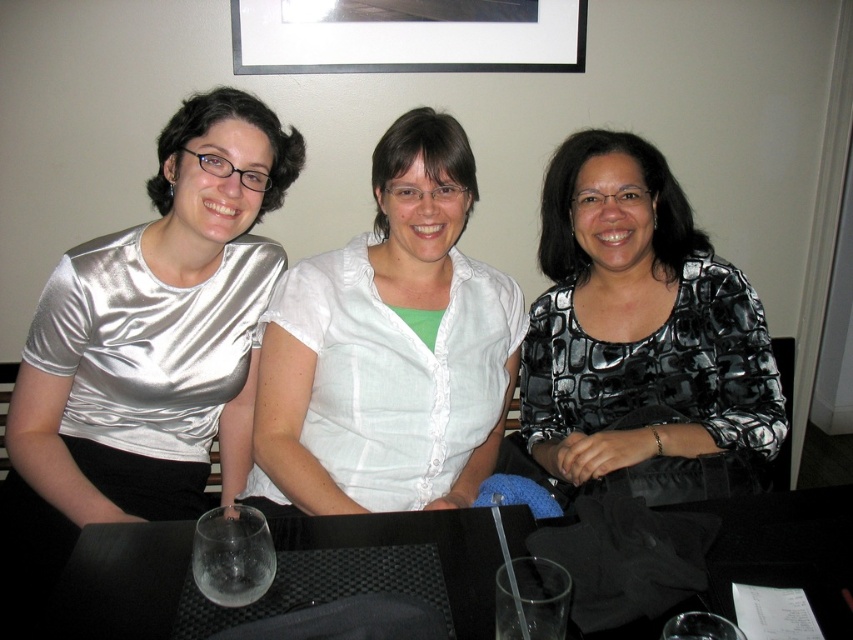
Is black matte table at center smaller than black matte picture frame at upper center?

Yes, black matte table at center is smaller than black matte picture frame at upper center.

Between black matte table at center and black matte picture frame at upper center, which one is positioned higher?

black matte picture frame at upper center is above.

What do you see at coordinates (785, 548) in the screenshot?
I see `black matte table at center` at bounding box center [785, 548].

Where is `black matte table at center`? This screenshot has width=853, height=640. black matte table at center is located at coordinates (785, 548).

Does shiny silver blouse at left have a greater height compared to transparent plastic wine glass at lower center?

Correct, shiny silver blouse at left is much taller as transparent plastic wine glass at lower center.

Is point (99, 273) in front of point (541, 612)?

No, it is not.

This screenshot has width=853, height=640. Describe the element at coordinates (146, 349) in the screenshot. I see `shiny silver blouse at left` at that location.

Where is `shiny silver blouse at left`? shiny silver blouse at left is located at coordinates (146, 349).

Can you confirm if white linen shirt at center is bigger than transparent plastic wine glass at lower center?

Indeed, white linen shirt at center has a larger size compared to transparent plastic wine glass at lower center.

Is white linen shirt at center in front of transparent plastic wine glass at lower center?

No, it is not.

Who is more forward, (267, 388) or (527, 579)?

Point (527, 579)

Locate an element on the screen. The width and height of the screenshot is (853, 640). white linen shirt at center is located at coordinates (390, 348).